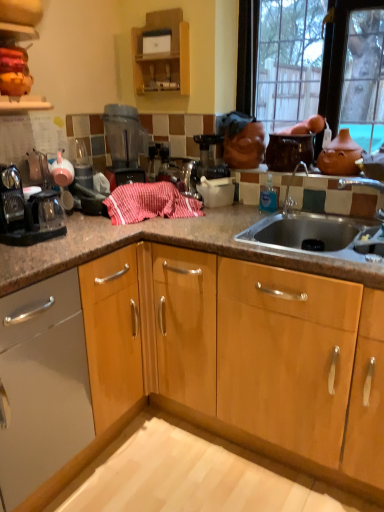
Question: Based on their sizes in the image, would you say red striped cloth at center is bigger or smaller than wooden cabinet at upper center?

Choices:
 (A) small
 (B) big

Answer: (B)

Question: Considering the positions of point (125, 197) and point (160, 71), is point (125, 197) closer or farther from the camera than point (160, 71)?

Choices:
 (A) farther
 (B) closer

Answer: (B)

Question: Estimate the real-world distances between objects in this image. Which object is farther from the red striped cloth at center?

Choices:
 (A) transparent plastic blender at upper center
 (B) wooden cabinet at upper center
 (C) matte glass window at upper right
 (D) matte black coffee maker at left
 (E) terracotta clay teapot at upper right

Answer: (C)

Question: Which object is positioned farthest from the transparent plastic blender at upper center?

Choices:
 (A) wooden cabinet at upper center
 (B) matte black coffee maker at left
 (C) matte glass window at upper right
 (D) red striped cloth at center
 (E) terracotta clay teapot at upper right

Answer: (E)